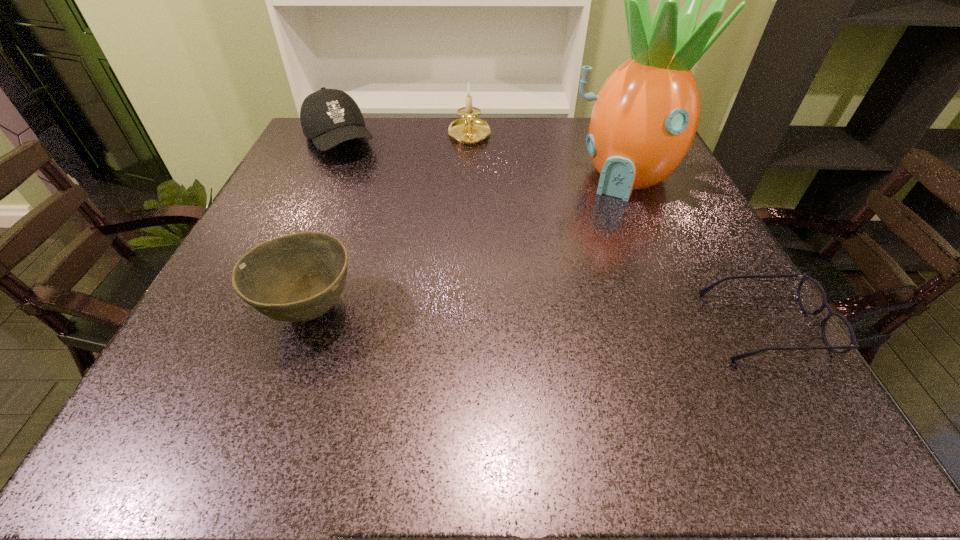
Where is `free space at the left edge of the desktop`? The width and height of the screenshot is (960, 540). free space at the left edge of the desktop is located at coordinates (243, 250).

This screenshot has height=540, width=960. In the image, there is a desktop. Find the location of `vacant area at the right edge`. vacant area at the right edge is located at coordinates (670, 280).

At what (x,y) coordinates should I click in order to perform the action: click on vacant space at the near left corner of the desktop. Please return your answer as a coordinate pair (x, y). This screenshot has width=960, height=540. Looking at the image, I should click on (246, 364).

You are a GUI agent. You are given a task and a screenshot of the screen. Output one action in this format:
    pyautogui.click(x=<x>, y=<y>)
    Task: Click on the empty space that is in between the spectacles and the bowl
    This screenshot has width=960, height=540.
    Given the screenshot: What is the action you would take?
    pyautogui.click(x=537, y=319)

Where is `free space between the pineapple and the shortest object`? This screenshot has height=540, width=960. free space between the pineapple and the shortest object is located at coordinates (694, 251).

I want to click on empty space between the baseball cap and the candle holder, so click(x=404, y=139).

Find the location of a particular element. This screenshot has width=960, height=540. free space between the bowl and the shortest object is located at coordinates (537, 319).

Where is `vacant region between the third object from right to left and the bowl`? This screenshot has width=960, height=540. vacant region between the third object from right to left and the bowl is located at coordinates (390, 224).

Where is `free point between the pineapple and the candle holder`? The image size is (960, 540). free point between the pineapple and the candle holder is located at coordinates (546, 156).

You are a GUI agent. You are given a task and a screenshot of the screen. Output one action in this format:
    pyautogui.click(x=<x>, y=<y>)
    Task: Click on the vacant area that lies between the shortest object and the third object from right to left
    
    Given the screenshot: What is the action you would take?
    pyautogui.click(x=616, y=231)